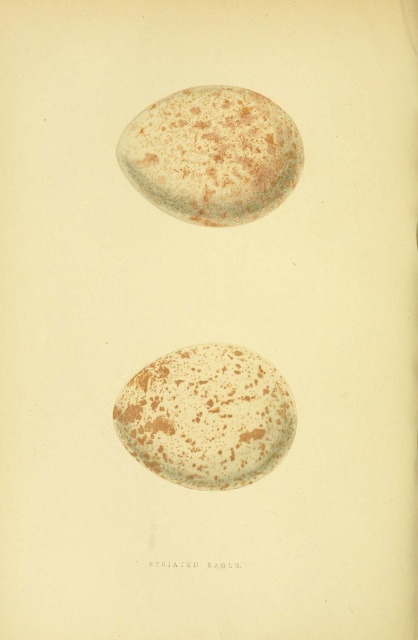
Between speckled egg at bottom and speckled egg at upper center, which one is positioned lower?

speckled egg at bottom is below.

Is speckled egg at bottom positioned in front of speckled egg at upper center?

Yes, it is.

Between point (244, 449) and point (134, 128), which one is positioned behind?

Positioned behind is point (134, 128).

The height and width of the screenshot is (640, 418). Find the location of `speckled egg at bottom`. speckled egg at bottom is located at coordinates (206, 417).